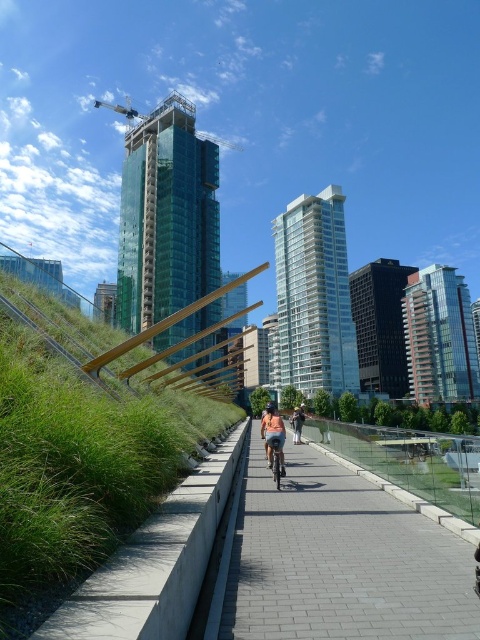
Question: Can you confirm if denim shorts at center is positioned to the left of metallic silver bicycle at center?

Choices:
 (A) yes
 (B) no

Answer: (B)

Question: Can you confirm if denim shorts at center is positioned above metallic silver bicycle at center?

Choices:
 (A) yes
 (B) no

Answer: (B)

Question: Can you confirm if green grass at center is wider than metallic silver bicycle at center?

Choices:
 (A) no
 (B) yes

Answer: (B)

Question: Which of these objects is positioned farthest from the green grass at center?

Choices:
 (A) metallic silver bicycle at center
 (B) denim shorts at center
 (C) gray brick pavement at center

Answer: (A)

Question: Based on their relative distances, which object is farther from the gray brick pavement at center?

Choices:
 (A) denim shorts at center
 (B) green grass at center
 (C) metallic silver bicycle at center

Answer: (B)

Question: Which point is closer to the camera?

Choices:
 (A) denim shorts at center
 (B) green grass at center

Answer: (B)